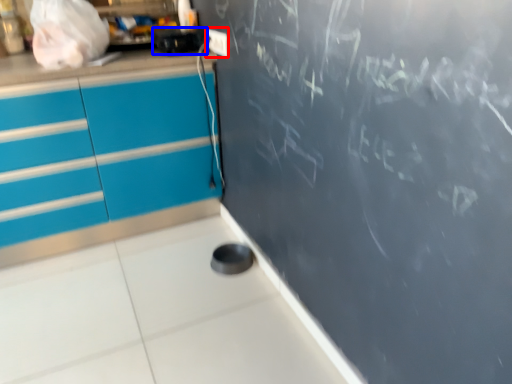
Question: Which of the following is the farthest to the observer, electric outlet (highlighted by a red box) or appliance (highlighted by a blue box)?

Choices:
 (A) electric outlet
 (B) appliance

Answer: (A)